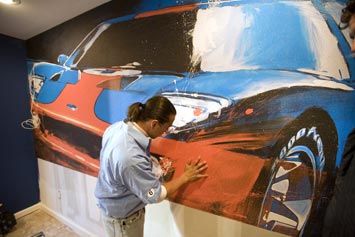
What are the coordinates of `ceiling` in the screenshot? It's located at (43, 21).